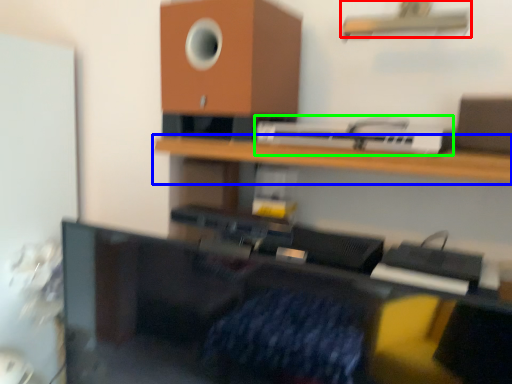
Question: Which is nearer to the shelf (highlighted by a red box)? shelf (highlighted by a blue box) or printer (highlighted by a green box).

Choices:
 (A) shelf
 (B) printer

Answer: (B)